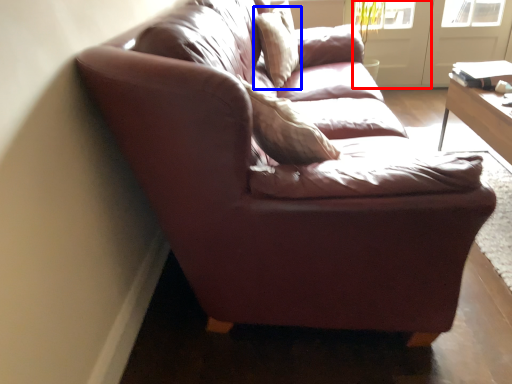
Question: Which object is closer to the camera taking this photo, screen door (highlighted by a red box) or pillow (highlighted by a blue box)?

Choices:
 (A) screen door
 (B) pillow

Answer: (B)